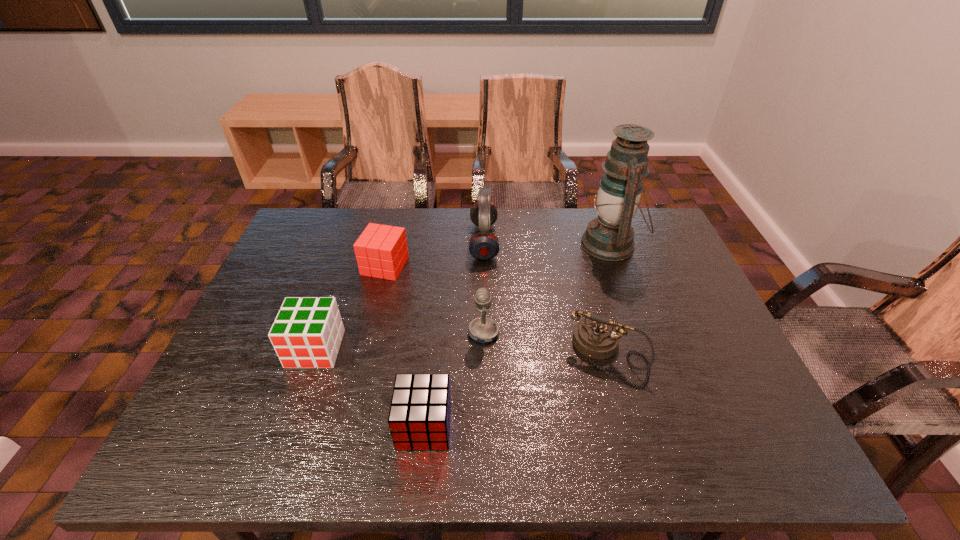
You are a GUI agent. You are given a task and a screenshot of the screen. Output one action in this format:
    pyautogui.click(x=<x>, y=<y>)
    Task: Click on the free space at the far right corner
    
    Given the screenshot: What is the action you would take?
    pyautogui.click(x=636, y=237)

Identify the location of free spot between the fifth object from right to left and the third tallest object. (454, 380).

The width and height of the screenshot is (960, 540). I want to click on blank region between the second farthest cube and the microphone, so click(x=399, y=341).

The height and width of the screenshot is (540, 960). What are the coordinates of `vacant space in between the tallest object and the rightmost cube` in the screenshot? It's located at (517, 335).

Find the location of a particular element. This screenshot has width=960, height=540. vacant area that lies between the tallest object and the earphone is located at coordinates (547, 243).

At what (x,y) coordinates should I click in order to perform the action: click on free point between the second tallest object and the farthest cube. Please return your answer as a coordinate pair (x, y). The height and width of the screenshot is (540, 960). Looking at the image, I should click on (435, 254).

The image size is (960, 540). In order to click on vacant area that lies between the microphone and the second farthest cube in this screenshot , I will do `click(399, 341)`.

Where is `vacant space that's between the nearest object and the farthest cube`? Image resolution: width=960 pixels, height=540 pixels. vacant space that's between the nearest object and the farthest cube is located at coordinates (405, 346).

Image resolution: width=960 pixels, height=540 pixels. In order to click on free space between the second farthest cube and the farthest cube in this screenshot , I will do `click(350, 307)`.

Locate an element on the screen. The image size is (960, 540). vacant area that lies between the tallest object and the farthest cube is located at coordinates (497, 255).